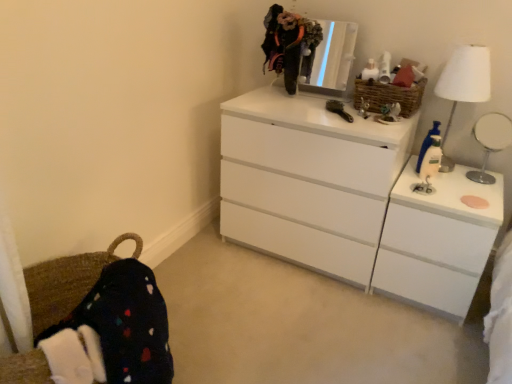
Question: Does white glossy mirror at upper right have a lesser width compared to blue plastic bottle at right?

Choices:
 (A) no
 (B) yes

Answer: (A)

Question: Considering the relative sizes of white glossy mirror at upper right and blue plastic bottle at right in the image provided, is white glossy mirror at upper right wider than blue plastic bottle at right?

Choices:
 (A) no
 (B) yes

Answer: (B)

Question: From a real-world perspective, is white glossy mirror at upper right positioned over blue plastic bottle at right based on gravity?

Choices:
 (A) yes
 (B) no

Answer: (A)

Question: Is white glossy mirror at upper right beside blue plastic bottle at right?

Choices:
 (A) no
 (B) yes

Answer: (A)

Question: Is white glossy mirror at upper right positioned beyond the bounds of blue plastic bottle at right?

Choices:
 (A) yes
 (B) no

Answer: (A)

Question: From the image's perspective, is blue plastic bottle at right located above or below white glossy mirror at upper right?

Choices:
 (A) above
 (B) below

Answer: (B)

Question: From a real-world perspective, is blue plastic bottle at right positioned above or below white glossy mirror at upper right?

Choices:
 (A) below
 (B) above

Answer: (A)

Question: In the image, is blue plastic bottle at right positioned in front of or behind white glossy mirror at upper right?

Choices:
 (A) behind
 (B) front

Answer: (A)

Question: Considering the positions of blue plastic bottle at right and white glossy mirror at upper right in the image, is blue plastic bottle at right taller or shorter than white glossy mirror at upper right?

Choices:
 (A) tall
 (B) short

Answer: (B)

Question: Considering the positions of woven brown basket at upper right and metallic reflective mirror at upper center in the image, is woven brown basket at upper right bigger or smaller than metallic reflective mirror at upper center?

Choices:
 (A) big
 (B) small

Answer: (B)

Question: Is point (411, 107) positioned closer to the camera than point (347, 31)?

Choices:
 (A) farther
 (B) closer

Answer: (B)

Question: From a real-world perspective, is woven brown basket at upper right positioned above or below metallic reflective mirror at upper center?

Choices:
 (A) above
 (B) below

Answer: (B)

Question: From the image's perspective, is woven brown basket at upper right located above or below metallic reflective mirror at upper center?

Choices:
 (A) above
 (B) below

Answer: (B)

Question: Would you say white glossy file cabinet at right is to the left or to the right of white glossy chest of drawers at upper right in the picture?

Choices:
 (A) right
 (B) left

Answer: (A)

Question: Is white glossy file cabinet at right inside the boundaries of white glossy chest of drawers at upper right, or outside?

Choices:
 (A) outside
 (B) inside

Answer: (A)